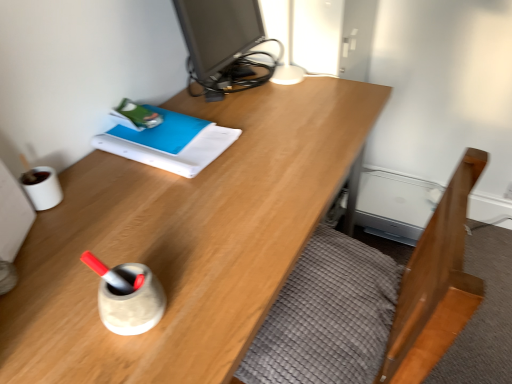
Where is `empty space that is to the right of matte black monitor at upper center`? The image size is (512, 384). empty space that is to the right of matte black monitor at upper center is located at coordinates (330, 99).